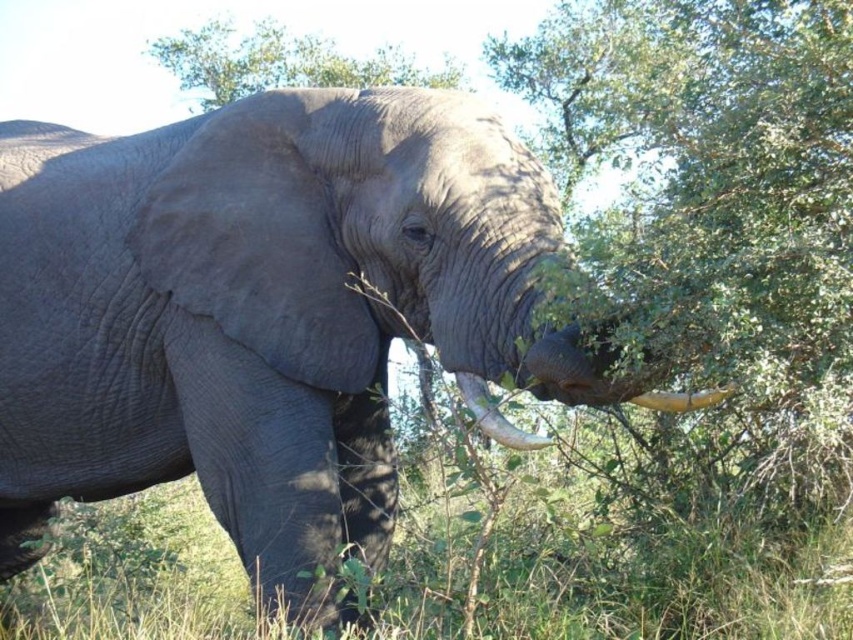
Question: Is white ivory tusk at lower right further to camera compared to matte gray tusk at lower left?

Choices:
 (A) no
 (B) yes

Answer: (A)

Question: Which of the following is the closest to the observer?

Choices:
 (A) (181, 83)
 (B) (285, 422)
 (C) (473, 408)
 (D) (480, 568)

Answer: (C)

Question: Among these objects, which one is farthest from the camera?

Choices:
 (A) green grass at lower left
 (B) green leafy tree at upper center
 (C) white ivory tusk at lower right
 (D) green leafy tree at center

Answer: (B)

Question: Does gray matte elephant at center have a greater width compared to green grass at lower left?

Choices:
 (A) yes
 (B) no

Answer: (A)

Question: Is gray matte elephant at center wider than green leafy tree at upper center?

Choices:
 (A) yes
 (B) no

Answer: (B)

Question: Which object appears closest to the camera in this image?

Choices:
 (A) green leafy tree at center
 (B) matte gray tusk at lower left
 (C) green leafy tree at upper center

Answer: (B)